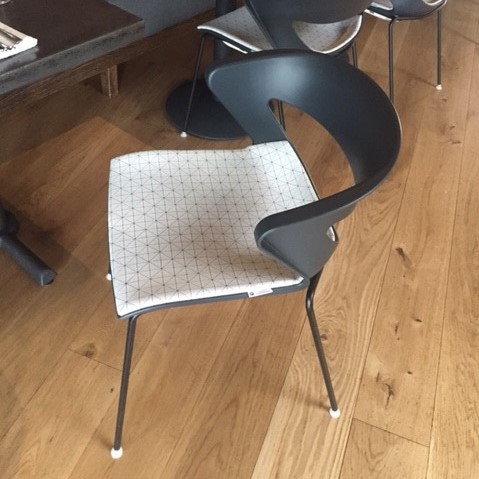
I want to click on circular black furniture base, so coord(211,107).